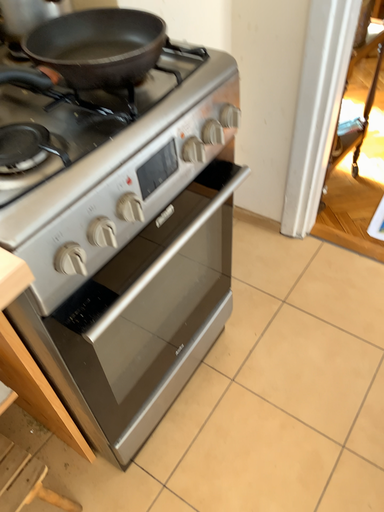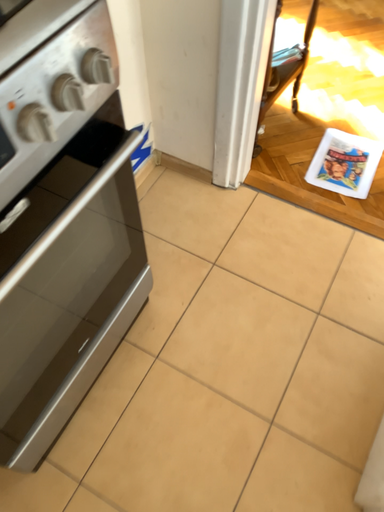
Question: Which way did the camera rotate in the video?

Choices:
 (A) rotated downward
 (B) rotated upward

Answer: (A)